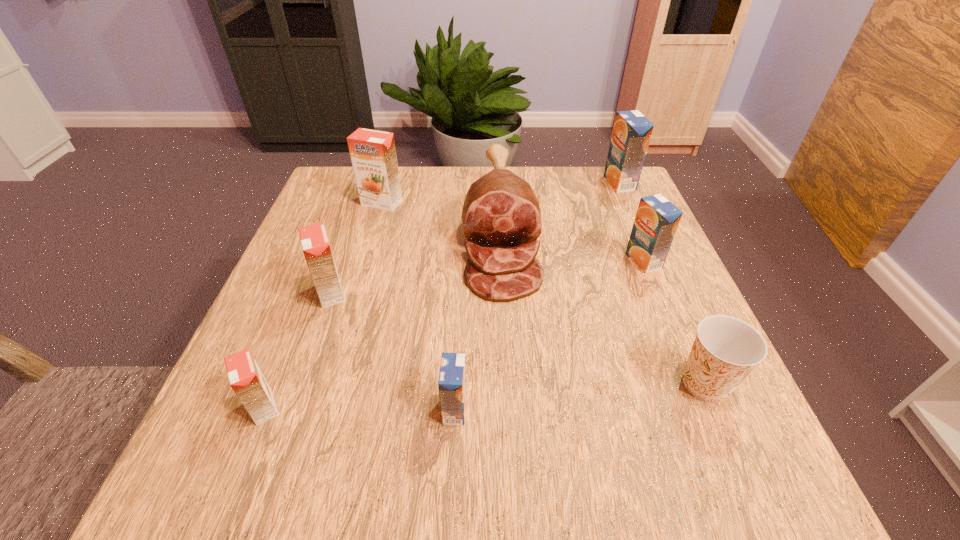
Where is `the farthest blue orange_juice`? the farthest blue orange_juice is located at coordinates (632, 131).

Find the location of a particular element. the farthest orange_juice is located at coordinates (632, 131).

This screenshot has width=960, height=540. I want to click on the biggest orange orange juice, so click(x=373, y=154).

This screenshot has width=960, height=540. Identify the location of the farthest orange orange juice. (373, 154).

Locate an element on the screen. This screenshot has height=540, width=960. ham is located at coordinates click(x=501, y=213).

This screenshot has width=960, height=540. I want to click on the third nearest orange_juice, so click(x=315, y=244).

The image size is (960, 540). Find the location of `the second farthest orange orange juice`. the second farthest orange orange juice is located at coordinates (315, 244).

What are the coordinates of `the third farthest orange_juice` in the screenshot? It's located at (657, 219).

Identify the location of the second biggest blue orange_juice. (657, 219).

The height and width of the screenshot is (540, 960). What are the coordinates of `Dixie cup` in the screenshot? It's located at (726, 349).